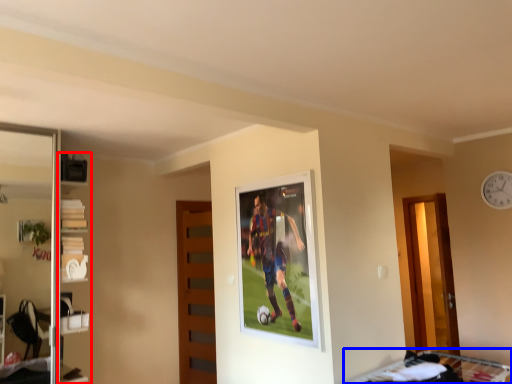
Question: Among these objects, which one is farthest to the camera, shelf (highlighted by a red box) or bunk bed (highlighted by a blue box)?

Choices:
 (A) shelf
 (B) bunk bed

Answer: (A)